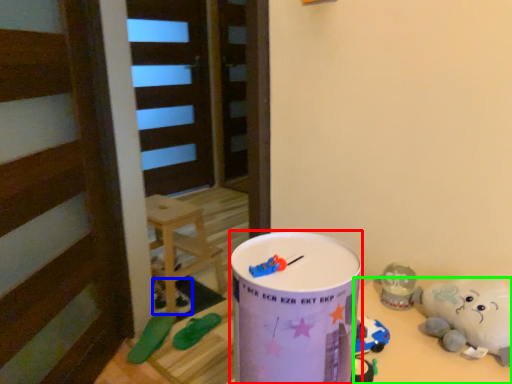
Question: Estimate the real-world distances between objects in this image. Which object is farther from milk can (highlighted by a red box), toy (highlighted by a blue box) or table (highlighted by a green box)?

Choices:
 (A) toy
 (B) table

Answer: (A)